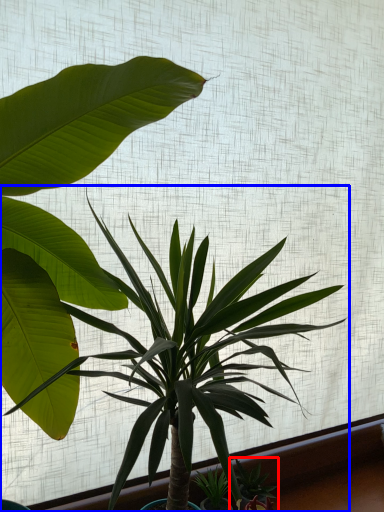
Question: Among these objects, which one is nearest to the camera, houseplant (highlighted by a red box) or houseplant (highlighted by a blue box)?

Choices:
 (A) houseplant
 (B) houseplant

Answer: (B)